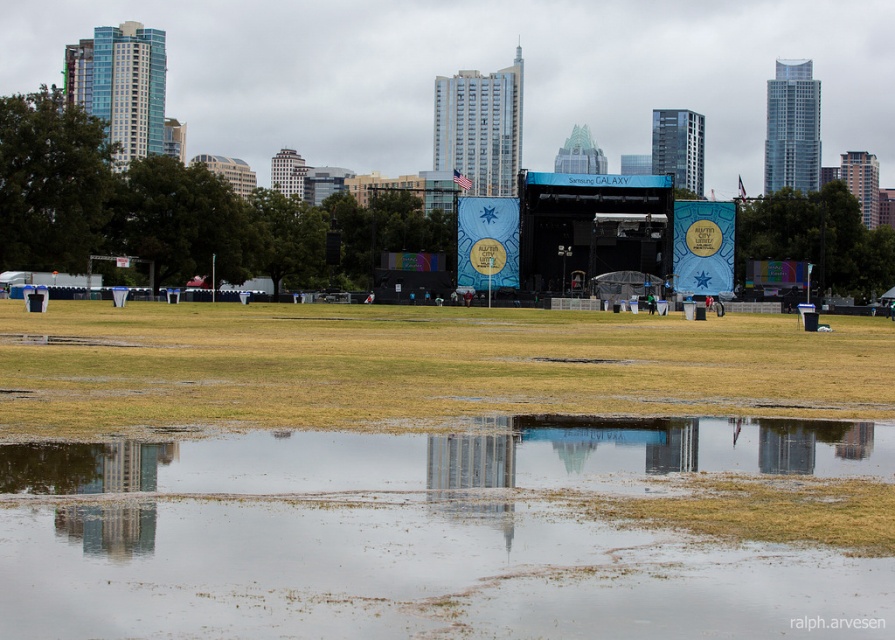
Who is more forward, (240, 534) or (804, 376)?

Positioned in front is point (240, 534).

Is transparent water at lower center smaller than brown grass at lower center?

Yes, transparent water at lower center is smaller than brown grass at lower center.

Who is more forward, (48, 513) or (487, 401)?

Point (48, 513) is more forward.

Where is `transparent water at lower center`? This screenshot has width=895, height=640. transparent water at lower center is located at coordinates (425, 534).